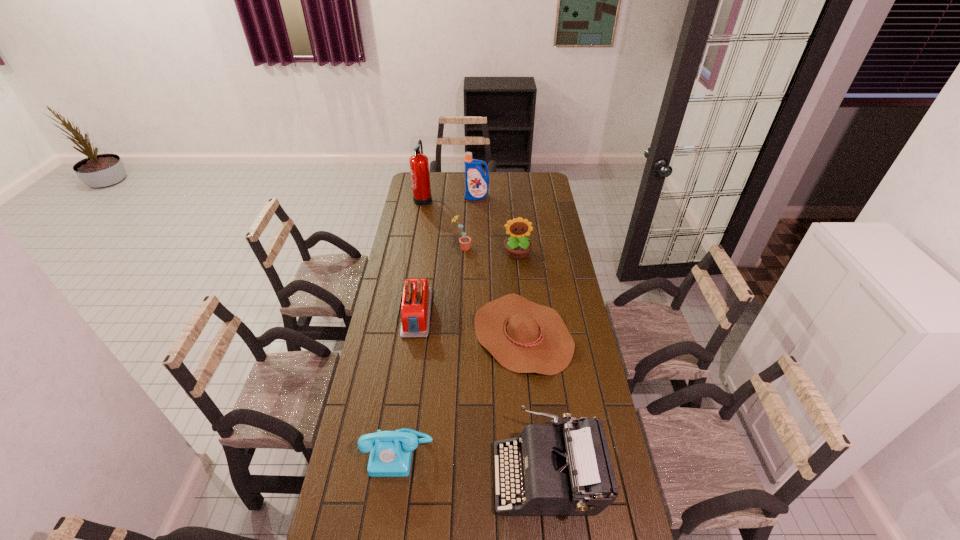
The width and height of the screenshot is (960, 540). I want to click on free spot located 0.100m on the face of the right sunflower, so click(x=519, y=275).

In order to click on vacant region located 0.140m on the flower of the left sunflower in this screenshot , I will do `click(499, 248)`.

Where is `vacant space located 0.360m on the back of the toaster`? The height and width of the screenshot is (540, 960). vacant space located 0.360m on the back of the toaster is located at coordinates (427, 240).

Where is `vacant space located on the front-facing side of the typewriter`? The height and width of the screenshot is (540, 960). vacant space located on the front-facing side of the typewriter is located at coordinates (401, 476).

Locate an element on the screen. The height and width of the screenshot is (540, 960). vacant space located on the front-facing side of the typewriter is located at coordinates click(367, 476).

Where is `free space located on the front-facing side of the typewriter`? The height and width of the screenshot is (540, 960). free space located on the front-facing side of the typewriter is located at coordinates tap(427, 476).

At what (x,y) coordinates should I click in order to perform the action: click on free region located on the dial of the telephone. Please return your answer as a coordinate pair (x, y). The image size is (960, 540). Looking at the image, I should click on (387, 529).

This screenshot has height=540, width=960. Find the location of `free space located 0.230m on the left of the cowboy hat`. free space located 0.230m on the left of the cowboy hat is located at coordinates (419, 334).

Image resolution: width=960 pixels, height=540 pixels. I want to click on object that is at the far edge, so click(419, 166).

Find the location of a particular element. This screenshot has height=540, width=960. fire extinguisher that is at the left edge is located at coordinates (419, 166).